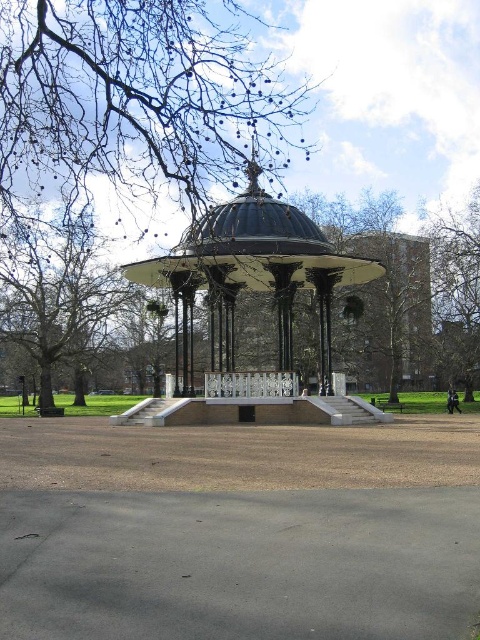
Is brown leafy tree at left positioned at the back of wooden park bench at lower right?

No, brown leafy tree at left is closer to the viewer.

Image resolution: width=480 pixels, height=640 pixels. I want to click on brown leafy tree at left, so click(58, 294).

In order to click on brown leafy tree at left in this screenshot , I will do `click(58, 294)`.

Who is more forward, (x=11, y=326) or (x=453, y=232)?

Point (x=453, y=232) is in front.

Does brown leafy tree at left lie in front of smooth bark tree at right?

Yes.

Is point (104, 339) positioned after point (472, 259)?

Yes.

Locate an element on the screen. The image size is (480, 640). brown leafy tree at left is located at coordinates (58, 294).

Is point (259, 163) positioned in front of point (253, 256)?

That is False.

Which is more to the left, smooth bark tree at upper center or black metal gazebo at center?

From the viewer's perspective, smooth bark tree at upper center appears more on the left side.

At what (x,y) coordinates should I click in order to perform the action: click on smooth bark tree at upper center. Please return your answer as a coordinate pair (x, y). Looking at the image, I should click on tap(139, 100).